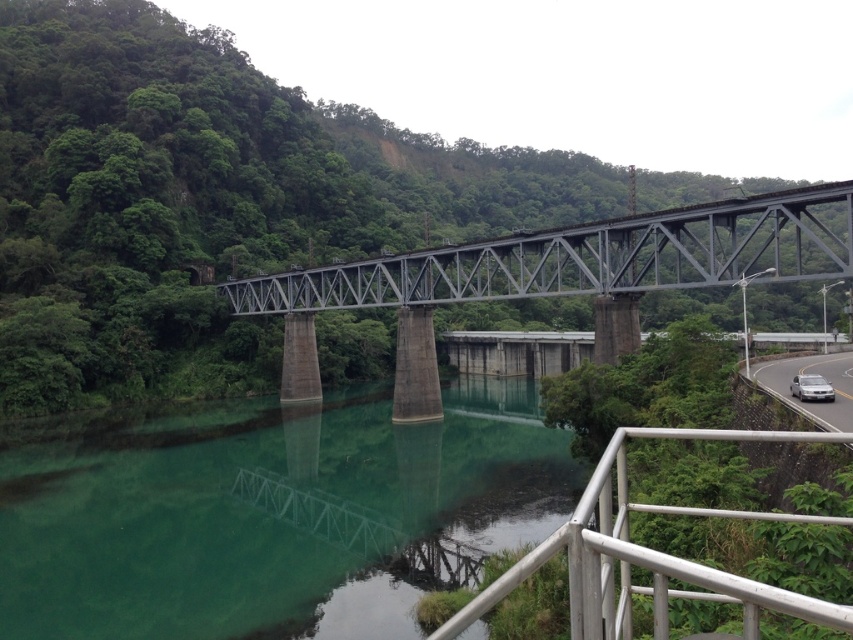
Question: Which point appears closest to the camera in this image?

Choices:
 (A) 807,381
 (B) 675,570

Answer: (B)

Question: Does green concrete river at center lie behind metallic gray bridge at center?

Choices:
 (A) no
 (B) yes

Answer: (A)

Question: Which of the following is the closest to the observer?

Choices:
 (A) (668, 509)
 (B) (287, 634)
 (C) (791, 388)

Answer: (A)

Question: Which point is farther to the camera?

Choices:
 (A) (807, 365)
 (B) (93, 544)
 (C) (430, 384)
 (D) (793, 378)

Answer: (C)

Question: Does green concrete river at center appear under white glossy car at right?

Choices:
 (A) yes
 (B) no

Answer: (A)

Question: Does green concrete river at center have a greater width compared to white glossy sedan at right?

Choices:
 (A) no
 (B) yes

Answer: (B)